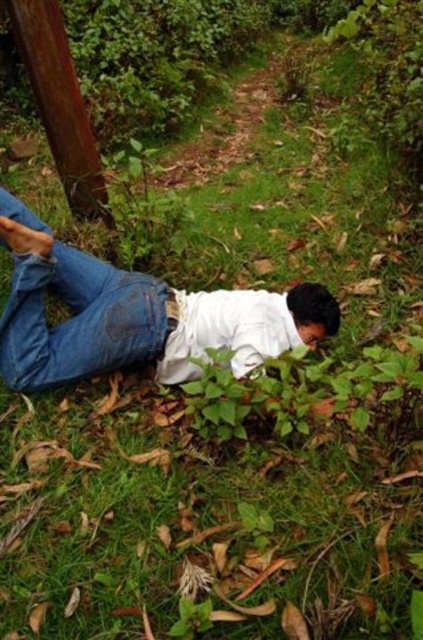
You are taking a photo of the person lying on the grass and want to focus on both point (18, 230) and point (30, 276). Which point should you focus on first to ensure both are in sharp focus?

You should focus on point (18, 230) first because it is closer to the camera. By focusing on the closer point, the farther point (30, 276) will also be in focus due to the depth of field.

You are a photographer trying to capture the jeans at lower left and the brushed wood telegraph pole at upper left in the same frame. Which object should you focus on first to ensure both are in focus?

You should focus on the jeans at lower left first because it is closer to you than the brushed wood telegraph pole at upper left, so focusing on the closer object will help both be in focus.

You are a photographer trying to capture the entire scene in one shot. Given that the jeans at lower left and the brushed wood telegraph pole at upper left are both in your frame, which object would you need to adjust your camera angle to include more of? Explain your reasoning based on their sizes in the image.

The jeans at lower left are bigger than the brushed wood telegraph pole at upper left. To capture more of the jeans at lower left, you would need to adjust your camera angle since they occupy a larger portion of the frame compared to the telegraph pole.